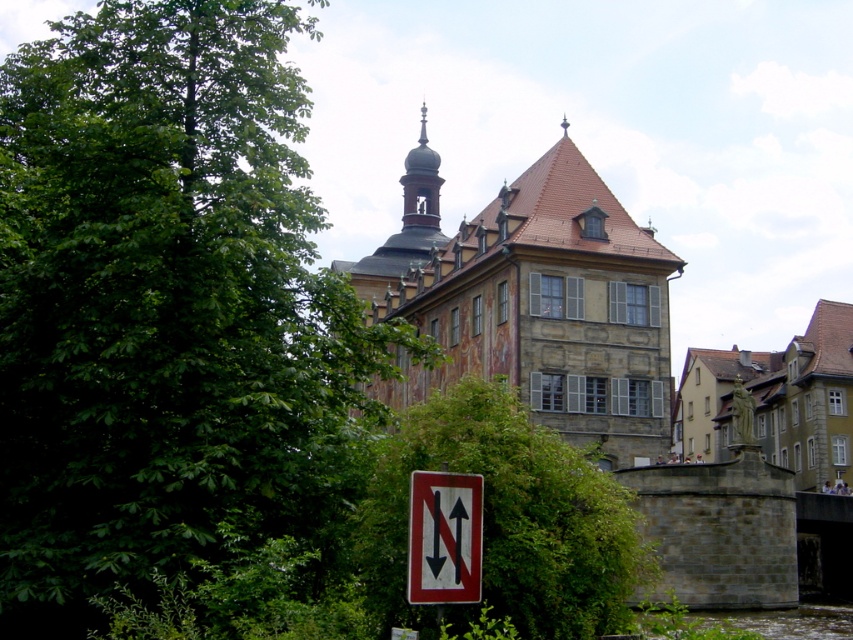
You are standing in front of the European building and see two points marked on the ground. The first point is at coordinates point (x=480, y=461) and the second is at point (x=848, y=358). Which point is closer to you?

Point (x=480, y=461) is in front of point (x=848, y=358), so it is closer to you.

You are standing in front of the European building and want to take a photo of the signpost. To avoid the green leafy tree at center, where should you move relative to the tree?

The green leafy tree at center is located at point 0.811 on the x axis and 0.594 on the y axis. To avoid it, move to the opposite direction of the tree from your current position.

You are standing at the point with coordinates (506, 518) in the image of the European building. What would you see directly in front of you?

The point at (506, 518) corresponds to a green leafy tree at center, so you would see the green leafy tree directly in front of you.